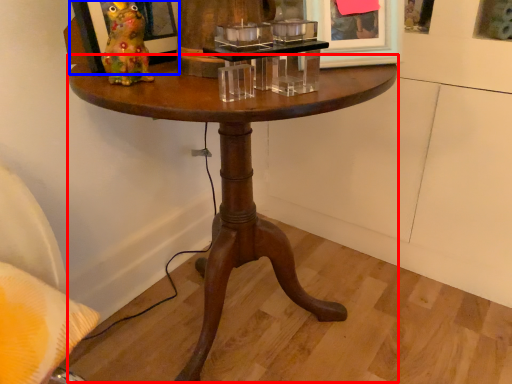
Question: Among these objects, which one is nearest to the camera, coffee table (highlighted by a red box) or picture frame (highlighted by a blue box)?

Choices:
 (A) coffee table
 (B) picture frame

Answer: (A)